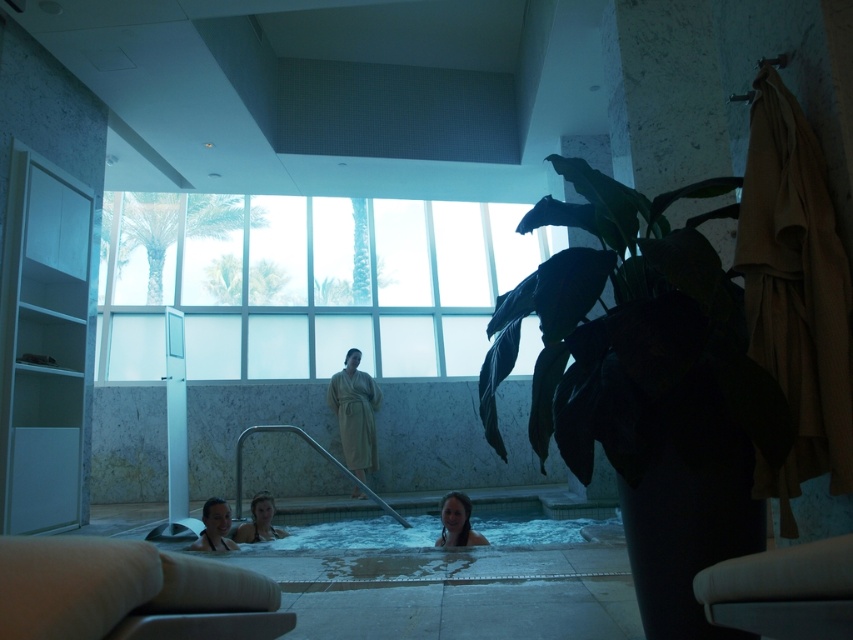
Is point (339, 388) less distant than point (213, 508)?

That is False.

Is point (352, 392) more distant than point (215, 540)?

Yes.

Where is `beige robe at center`? Image resolution: width=853 pixels, height=640 pixels. beige robe at center is located at coordinates (355, 413).

From the picture: Does smooth skin person at lower center have a smaller size compared to smooth white swimsuit at lower center?

No.

Which is above, smooth skin person at lower center or smooth white swimsuit at lower center?

smooth skin person at lower center is above.

The height and width of the screenshot is (640, 853). What do you see at coordinates (457, 522) in the screenshot? I see `smooth skin person at lower center` at bounding box center [457, 522].

Where is `smooth skin person at lower center`? This screenshot has height=640, width=853. smooth skin person at lower center is located at coordinates (457, 522).

Which is more to the left, smooth skin person at lower left or smooth white swimsuit at lower center?

Positioned to the left is smooth skin person at lower left.

Can you confirm if smooth skin person at lower left is positioned above smooth white swimsuit at lower center?

Indeed, smooth skin person at lower left is positioned over smooth white swimsuit at lower center.

What do you see at coordinates (213, 525) in the screenshot? I see `smooth skin person at lower left` at bounding box center [213, 525].

Image resolution: width=853 pixels, height=640 pixels. I want to click on smooth skin person at lower left, so click(213, 525).